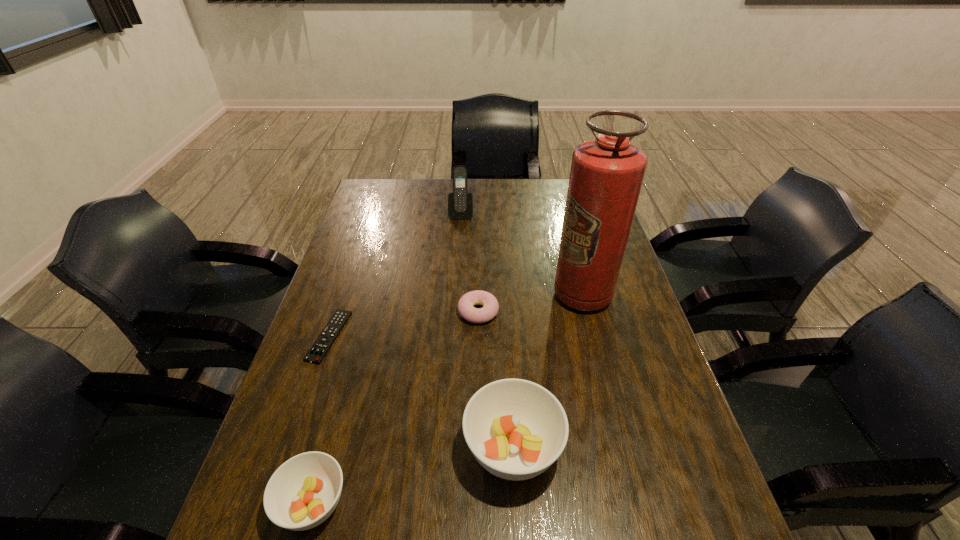
Find the location of a particular element. Image resolution: width=960 pixels, height=540 pixels. the right soup bowl is located at coordinates (516, 429).

The width and height of the screenshot is (960, 540). What are the coordinates of `the fourth shortest object` in the screenshot? It's located at (516, 429).

Find the location of a particular element. the farthest object is located at coordinates (460, 203).

Image resolution: width=960 pixels, height=540 pixels. In order to click on cellular telephone in this screenshot , I will do `click(460, 203)`.

Identify the location of fire extinguisher. (606, 176).

Where is `the tallest object`? Image resolution: width=960 pixels, height=540 pixels. the tallest object is located at coordinates (606, 176).

Identify the location of doughnut. The image size is (960, 540). (490, 308).

This screenshot has height=540, width=960. I want to click on the shortest object, so click(317, 352).

Identify the location of vacant region located on the left of the taller soup bowl. The width and height of the screenshot is (960, 540). (285, 448).

In order to click on vacant region located on the front-facing side of the fifth shortest object in this screenshot , I will do `click(458, 268)`.